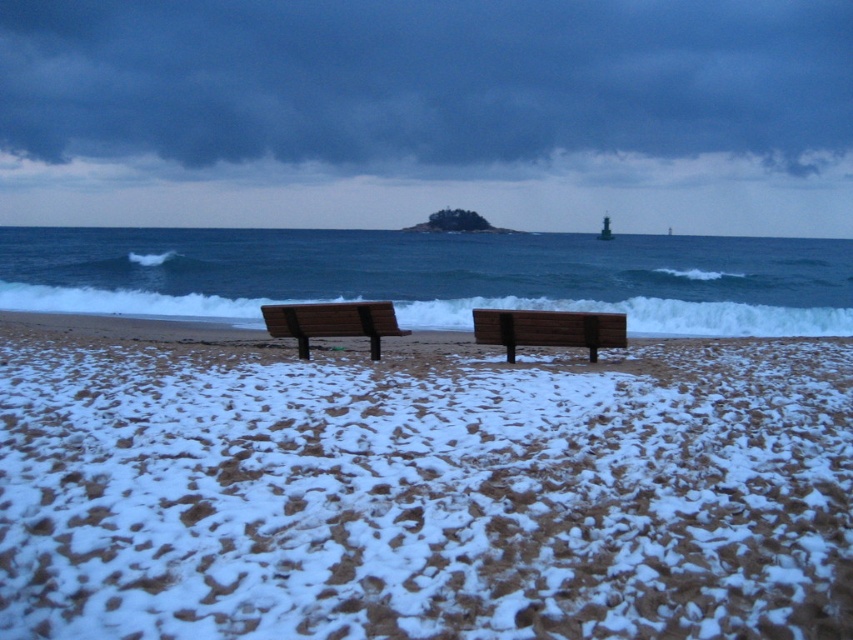
You are a person who wants to walk from the wooden bench at center to the ocean. The path is clear except for a 30 feet wide snowdrift. Can you walk around it without going further than 35 feet from the bench?

The wooden bench at center is 34.16 feet away from the ocean. Since the snowdrift is 30 feet wide, you can walk around it within the 35 feet limit.

Consider the image. You are planning to set up a temporary tent on the white sandy beach at center. Considering the wooden bench at center is already placed there, will there be enough space to accommodate the tent without overlapping the bench?

The white sandy beach at center has a larger width than the wooden bench at center, so there should be sufficient space to place the tent without overlapping the bench.

You are standing on the beach and want to place a small flag exactly at the center of the white sandy beach at center. According to the coordinates provided, what are the coordinates where you should place the flag?

The coordinates for the center of the white sandy beach at center are at point (418,486), so you should place the flag at those coordinates.